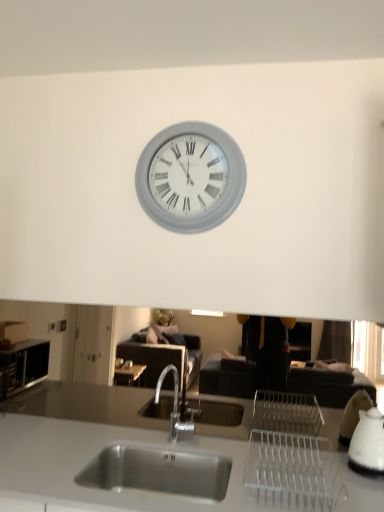
Image resolution: width=384 pixels, height=512 pixels. What are the coordinates of `gray matte clock at upper center` in the screenshot? It's located at (190, 177).

Measure the distance between point [219,497] and camera.

Point [219,497] and camera are 1.66 meters apart from each other.

You are a GUI agent. You are given a task and a screenshot of the screen. Output one action in this format:
    pyautogui.click(x=<x>, y=<y>)
    Task: Click on the gray matte clock at upper center
    Image resolution: width=384 pixels, height=512 pixels.
    Given the screenshot: What is the action you would take?
    pyautogui.click(x=190, y=177)

Can stainless steel sink at center be found inside white glossy kettle at right?

No, white glossy kettle at right does not contain stainless steel sink at center.

From a real-world perspective, does white glossy kettle at right sit lower than stainless steel sink at center?

Incorrect, from a real-world perspective, white glossy kettle at right is higher than stainless steel sink at center.

From the image's perspective, which object appears higher, white glossy kettle at right or stainless steel sink at center?

white glossy kettle at right, from the image's perspective.

Is white glossy kettle at right next to gray matte clock at upper center and touching it?

white glossy kettle at right and gray matte clock at upper center are clearly separated.

Considering the relative sizes of white glossy kettle at right and gray matte clock at upper center in the image provided, is white glossy kettle at right bigger than gray matte clock at upper center?

No.

From a real-world perspective, relative to gray matte clock at upper center, is white glossy kettle at right vertically above or below?

white glossy kettle at right is below gray matte clock at upper center.

Is gray matte clock at upper center located within white glossy kettle at right?

Actually, gray matte clock at upper center is outside white glossy kettle at right.

Between gray matte clock at upper center and white glossy kettle at right, which one has smaller size?

white glossy kettle at right.

Is the position of gray matte clock at upper center less distant than that of white glossy kettle at right?

No, it is not.

In the scene shown: Is gray matte clock at upper center not inside white glossy kettle at right?

Absolutely, gray matte clock at upper center is external to white glossy kettle at right.

Is gray matte clock at upper center far away from white glossy kettle at right?

Yes, gray matte clock at upper center and white glossy kettle at right are quite far apart.

Is stainless steel sink at center taller or shorter than white glossy kettle at right?

Considering their sizes, stainless steel sink at center has less height than white glossy kettle at right.

How distant is stainless steel sink at center from white glossy kettle at right?

stainless steel sink at center is 26.87 inches from white glossy kettle at right.

Can you tell me how much stainless steel sink at center and white glossy kettle at right differ in facing direction?

There is a 1.24-degree angle between the facing directions of stainless steel sink at center and white glossy kettle at right.

From the image's perspective, which one is positioned lower, stainless steel sink at center or white glossy kettle at right?

stainless steel sink at center, from the image's perspective.

How many degrees apart are the facing directions of gray matte clock at upper center and stainless steel sink at center?

The angular difference between gray matte clock at upper center and stainless steel sink at center is 0.000757 degrees.

From a real-world perspective, relative to stainless steel sink at center, is gray matte clock at upper center vertically above or below?

Clearly, from a real-world perspective, gray matte clock at upper center is above stainless steel sink at center.

Considering the sizes of objects gray matte clock at upper center and stainless steel sink at center in the image provided, who is thinner, gray matte clock at upper center or stainless steel sink at center?

Thinner between the two is gray matte clock at upper center.

From the picture: Are gray matte clock at upper center and stainless steel sink at center beside each other?

No, gray matte clock at upper center is not beside stainless steel sink at center.

Is stainless steel sink at center next to gray matte clock at upper center and touching it?

No, stainless steel sink at center is not with gray matte clock at upper center.

In the scene shown: Which of these two, stainless steel sink at center or gray matte clock at upper center, stands shorter?

stainless steel sink at center is shorter.

How many degrees apart are the facing directions of stainless steel sink at center and gray matte clock at upper center?

There is a 0.000757-degree angle between the facing directions of stainless steel sink at center and gray matte clock at upper center.

Which of these two, stainless steel sink at center or gray matte clock at upper center, is thinner?

With smaller width is gray matte clock at upper center.

Locate an element on the screen. The width and height of the screenshot is (384, 512). sink that appears below the white glossy kettle at right (from the image's perspective) is located at coordinates (158, 472).

This screenshot has height=512, width=384. I want to click on appliance below the gray matte clock at upper center (from a real-world perspective), so click(x=368, y=442).

Looking at this image, which object lies nearer to the anchor point gray matte clock at upper center, white glossy kettle at right or stainless steel sink at center?

The object closer to gray matte clock at upper center is stainless steel sink at center.

Based on their spatial positions, is stainless steel sink at center or gray matte clock at upper center closer to white glossy kettle at right?

stainless steel sink at center is closer to white glossy kettle at right.

From the image, which object appears to be nearer to stainless steel sink at center, white glossy kettle at right or gray matte clock at upper center?

Among the two, white glossy kettle at right is located nearer to stainless steel sink at center.

Based on their spatial positions, is gray matte clock at upper center or stainless steel sink at center further from white glossy kettle at right?

The object further to white glossy kettle at right is gray matte clock at upper center.

When comparing their distances from gray matte clock at upper center, does stainless steel sink at center or white glossy kettle at right seem further?

Among the two, white glossy kettle at right is located further to gray matte clock at upper center.

Based on their spatial positions, is gray matte clock at upper center or white glossy kettle at right closer to stainless steel sink at center?

white glossy kettle at right is positioned closer to the anchor stainless steel sink at center.

Find the location of a particular element. The image size is (384, 512). appliance that lies between gray matte clock at upper center and stainless steel sink at center from top to bottom is located at coordinates (368, 442).